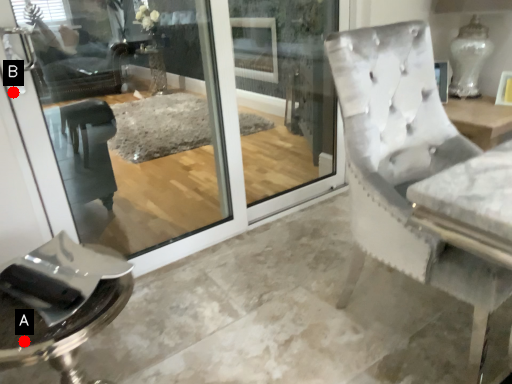
Question: Two points are circled on the image, labeled by A and B beside each circle. Among these points, which one is nearest to the camera?

Choices:
 (A) A is closer
 (B) B is closer

Answer: (A)